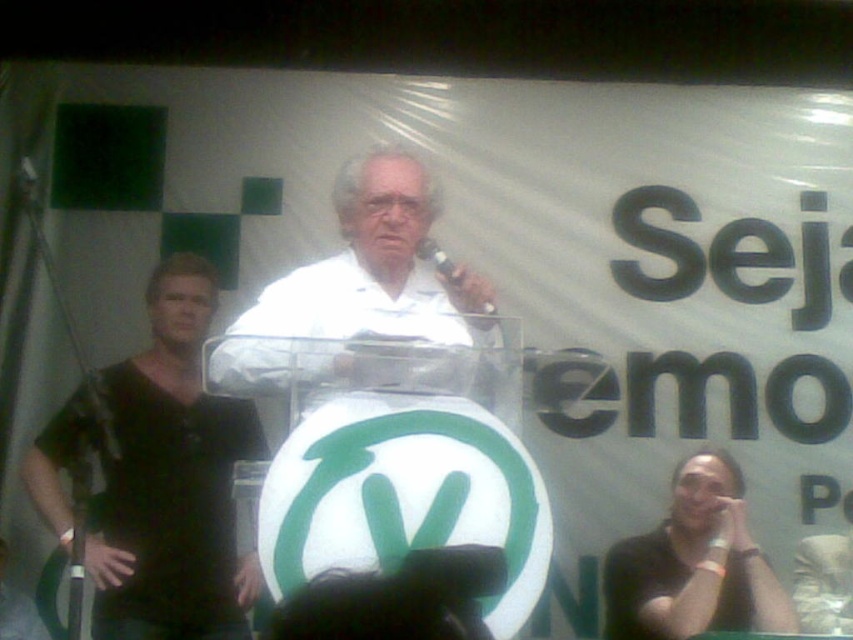
Question: Which of the following is the closest to the observer?

Choices:
 (A) (618, 604)
 (B) (244, 560)
 (C) (314, 316)

Answer: (C)

Question: Considering the relative positions of black matte shirt at left and black plastic microphone at center in the image provided, where is black matte shirt at left located with respect to black plastic microphone at center?

Choices:
 (A) left
 (B) right

Answer: (A)

Question: Which object is farther from the camera taking this photo?

Choices:
 (A) black matte shirt at left
 (B) black matte shirt at lower right

Answer: (A)

Question: Which object is farther from the camera taking this photo?

Choices:
 (A) white matte shirt at center
 (B) black matte shirt at lower right

Answer: (B)

Question: Is white matte shirt at center to the left of black plastic microphone at center from the viewer's perspective?

Choices:
 (A) yes
 (B) no

Answer: (A)

Question: From the image, what is the correct spatial relationship of black matte shirt at left in relation to white matte shirt at center?

Choices:
 (A) below
 (B) above

Answer: (A)